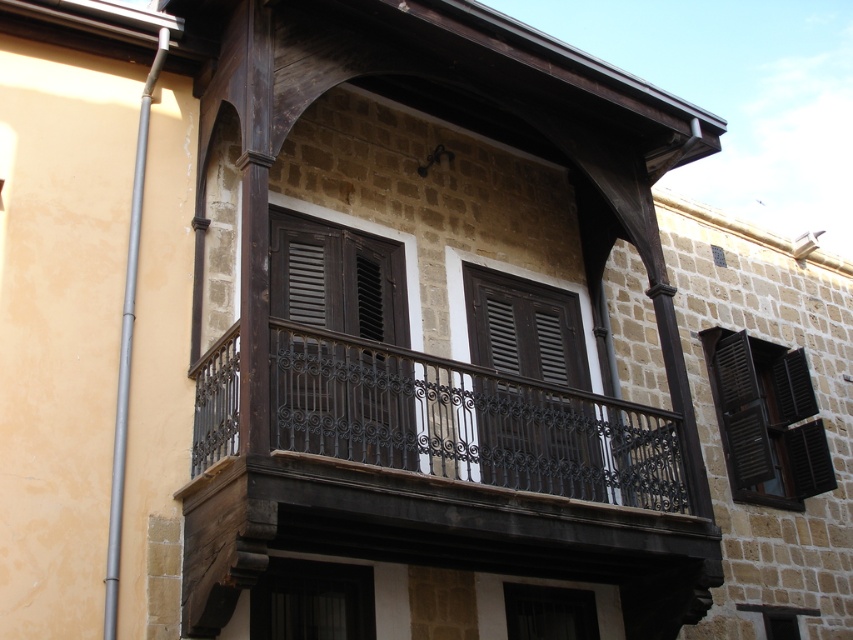
Question: Does matte dark brown wooden window at center appear over black matte window at center?

Choices:
 (A) yes
 (B) no

Answer: (A)

Question: Which point is closer to the camera?

Choices:
 (A) (289, 593)
 (B) (683, 548)

Answer: (A)

Question: Can you confirm if dark brown wrought iron balcony at center is smaller than black matte wood window at center?

Choices:
 (A) no
 (B) yes

Answer: (A)

Question: Which of the following is the closest to the observer?

Choices:
 (A) (318, 608)
 (B) (815, 464)
 (C) (635, 598)
 (D) (474, 268)

Answer: (A)

Question: In this image, where is matte dark brown wooden window at center located relative to black matte window at center?

Choices:
 (A) above
 (B) below

Answer: (A)

Question: Which point is farther to the camera?

Choices:
 (A) (418, 397)
 (B) (766, 420)
 (C) (352, 632)
 (D) (503, 472)

Answer: (B)